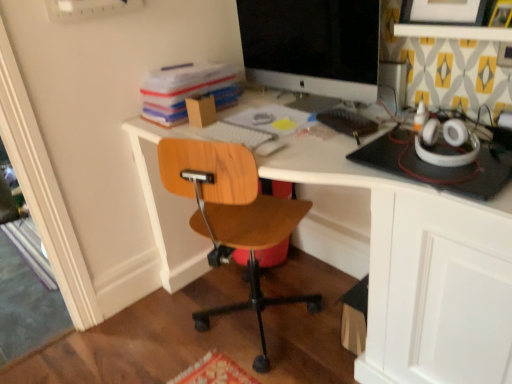
Consider the image. In order to face satin black monitor at upper center, should I rotate leftwards or rightwards?

To align with it, rotate right about 6.943°.

Locate an element on the screen. wooden chair at center is located at coordinates (231, 216).

Locate an element on the screen. matte black picture frame at upper right is located at coordinates (443, 12).

What do you see at coordinates (443, 12) in the screenshot? I see `matte black picture frame at upper right` at bounding box center [443, 12].

You are a GUI agent. You are given a task and a screenshot of the screen. Output one action in this format:
    pyautogui.click(x=<x>, y=<y>)
    Task: Click on the satin black monitor at upper center
    
    Given the screenshot: What is the action you would take?
    312,46

Consider the image. Is white glossy desk at center inside the boundaries of wooden chair at center, or outside?

white glossy desk at center exists outside the volume of wooden chair at center.

How much distance is there between white glossy desk at center and wooden chair at center?

They are 40.91 centimeters apart.

From the image's perspective, is white glossy desk at center above or below wooden chair at center?

Based on their image positions, white glossy desk at center is located above wooden chair at center.

Considering the sizes of objects white glossy desk at center and wooden chair at center in the image provided, who is smaller, white glossy desk at center or wooden chair at center?

wooden chair at center is smaller.

Considering the positions of objects stacked paperboard at upper left and wooden chair at center in the image provided, who is more to the right, stacked paperboard at upper left or wooden chair at center?

Positioned to the right is wooden chair at center.

Is stacked paperboard at upper left bigger than wooden chair at center?

No, stacked paperboard at upper left is not bigger than wooden chair at center.

Considering the positions of objects stacked paperboard at upper left and wooden chair at center in the image provided, who is behind, stacked paperboard at upper left or wooden chair at center?

stacked paperboard at upper left is further from the camera.

Is stacked paperboard at upper left positioned beyond the bounds of wooden chair at center?

Yes, stacked paperboard at upper left is not within wooden chair at center.

In the scene shown: Which is nearer, (276, 198) or (314, 153)?

The point (314, 153) is closer.

Which of these two, wooden chair at center or white glossy desk at center, stands taller?

white glossy desk at center is taller.

From a real-world perspective, is wooden chair at center positioned under white glossy desk at center based on gravity?

Yes.

Looking at this image, in the image, is wooden chair at center on the left side or the right side of white glossy desk at center?

Clearly, wooden chair at center is on the left of white glossy desk at center in the image.

Considering the sizes of objects stacked paperboard at upper left and matte black picture frame at upper right in the image provided, who is shorter, stacked paperboard at upper left or matte black picture frame at upper right?

stacked paperboard at upper left is shorter.

Considering the positions of points (204, 89) and (401, 20), is point (204, 89) closer to camera compared to point (401, 20)?

No, it is not.

Does stacked paperboard at upper left come behind matte black picture frame at upper right?

Yes, stacked paperboard at upper left is further from the viewer.

The width and height of the screenshot is (512, 384). Find the location of `book directly beneath the matte black picture frame at upper right (from a real-world perspective)`. book directly beneath the matte black picture frame at upper right (from a real-world perspective) is located at coordinates (186, 90).

Is white glossy desk at center looking in the opposite direction of matte black picture frame at upper right?

That's right, white glossy desk at center is facing away from matte black picture frame at upper right.

From the image's perspective, is white glossy desk at center under matte black picture frame at upper right?

Correct, white glossy desk at center appears lower than matte black picture frame at upper right in the image.

How much distance is there between white glossy desk at center and matte black picture frame at upper right?

25.17 inches.

Does white glossy desk at center have a greater height compared to matte black picture frame at upper right?

Correct, white glossy desk at center is much taller as matte black picture frame at upper right.

Is matte black picture frame at upper right not close to satin black monitor at upper center?

No, matte black picture frame at upper right is not far from satin black monitor at upper center.

Which object is further away from the camera, matte black picture frame at upper right or satin black monitor at upper center?

satin black monitor at upper center is further from the camera.

Looking at the image, does matte black picture frame at upper right seem bigger or smaller compared to satin black monitor at upper center?

Considering their sizes, matte black picture frame at upper right takes up less space than satin black monitor at upper center.

Does matte black picture frame at upper right have a lesser width compared to satin black monitor at upper center?

Indeed, matte black picture frame at upper right has a lesser width compared to satin black monitor at upper center.

From a real-world perspective, who is located higher, wooden chair at center or stacked paperboard at upper left?

stacked paperboard at upper left, from a real-world perspective.

Find the location of `book above the wooden chair at center (from the image's perspective)`. book above the wooden chair at center (from the image's perspective) is located at coordinates (186, 90).

Does wooden chair at center appear on the right side of stacked paperboard at upper left?

Yes, wooden chair at center is to the right of stacked paperboard at upper left.

Between wooden chair at center and stacked paperboard at upper left, which one has larger width?

wooden chair at center.

In order to click on chair that appears below the white glossy desk at center (from the image's perspective) in this screenshot , I will do `click(231, 216)`.

What are the coordinates of `book above the wooden chair at center (from a real-world perspective)` in the screenshot? It's located at (186, 90).

Looking at the image, which one is located closer to matte black picture frame at upper right, white glossy desk at center or stacked paperboard at upper left?

Among the two, white glossy desk at center is located nearer to matte black picture frame at upper right.

Estimate the real-world distances between objects in this image. Which object is closer to white glossy desk at center, wooden chair at center or satin black monitor at upper center?

wooden chair at center.

Looking at the image, which one is located closer to satin black monitor at upper center, wooden chair at center or stacked paperboard at upper left?

stacked paperboard at upper left is positioned closer to the anchor satin black monitor at upper center.

Estimate the real-world distances between objects in this image. Which object is further from stacked paperboard at upper left, white glossy desk at center or satin black monitor at upper center?

white glossy desk at center is further to stacked paperboard at upper left.

Based on their spatial positions, is stacked paperboard at upper left or wooden chair at center further from white glossy desk at center?

stacked paperboard at upper left.

Which object lies further to the anchor point stacked paperboard at upper left, wooden chair at center or satin black monitor at upper center?

Based on the image, wooden chair at center appears to be further to stacked paperboard at upper left.

Based on the photo, which object lies further to the anchor point matte black picture frame at upper right, wooden chair at center or stacked paperboard at upper left?

wooden chair at center.

Based on the photo, based on their spatial positions, is stacked paperboard at upper left or matte black picture frame at upper right further from satin black monitor at upper center?

Among the two, matte black picture frame at upper right is located further to satin black monitor at upper center.

Where is `computer monitor between stacked paperboard at upper left and matte black picture frame at upper right from left to right`? The image size is (512, 384). computer monitor between stacked paperboard at upper left and matte black picture frame at upper right from left to right is located at coordinates (312, 46).

What are the coordinates of `computer monitor between matte black picture frame at upper right and wooden chair at center in the up-down direction` in the screenshot? It's located at [312, 46].

Where is `picture frame between white glossy desk at center and stacked paperboard at upper left in the front-back direction`? This screenshot has width=512, height=384. picture frame between white glossy desk at center and stacked paperboard at upper left in the front-back direction is located at coordinates (443, 12).

The width and height of the screenshot is (512, 384). I want to click on chair between stacked paperboard at upper left and matte black picture frame at upper right from left to right, so click(231, 216).